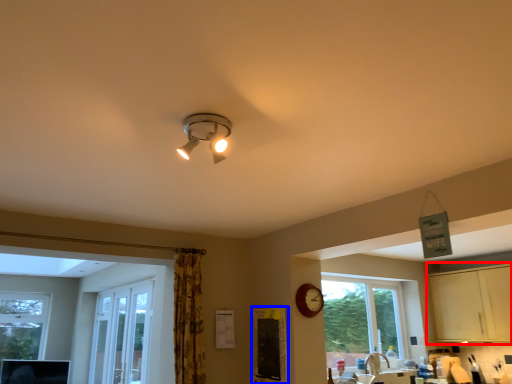
Question: Which of the following is the closest to the observer, dresser (highlighted by a red box) or bulletin board (highlighted by a blue box)?

Choices:
 (A) dresser
 (B) bulletin board

Answer: (B)